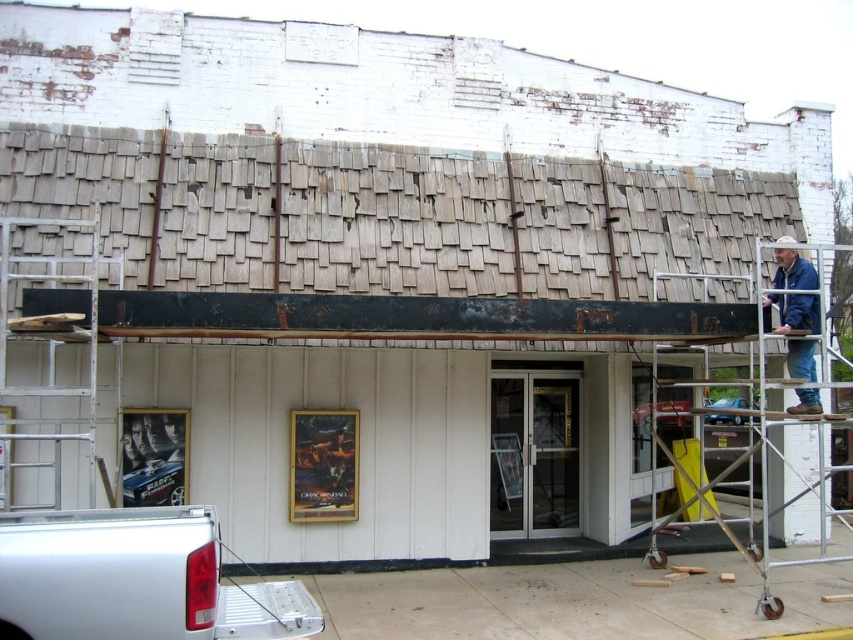
Is white metallic truck at lower left positioned behind silver metallic ladder at left?

That is False.

Who is more forward, [54,541] or [61,432]?

Point [54,541]

Find the location of a particular element. The height and width of the screenshot is (640, 853). white metallic truck at lower left is located at coordinates (135, 579).

How much distance is there between silver metallic ladder at left and metal scaffolding at right?

A distance of 7.41 meters exists between silver metallic ladder at left and metal scaffolding at right.

Can you confirm if silver metallic ladder at left is positioned below metal scaffolding at right?

No.

Which is behind, point (73, 460) or point (735, 280)?

Positioned behind is point (735, 280).

I want to click on silver metallic ladder at left, so click(56, 364).

Is silver metallic ladder at left thinner than blue denim jacket at upper right?

In fact, silver metallic ladder at left might be wider than blue denim jacket at upper right.

Who is more forward, (x=44, y=266) or (x=807, y=300)?

Point (x=807, y=300)

What are the coordinates of `silver metallic ladder at left` in the screenshot? It's located at (56, 364).